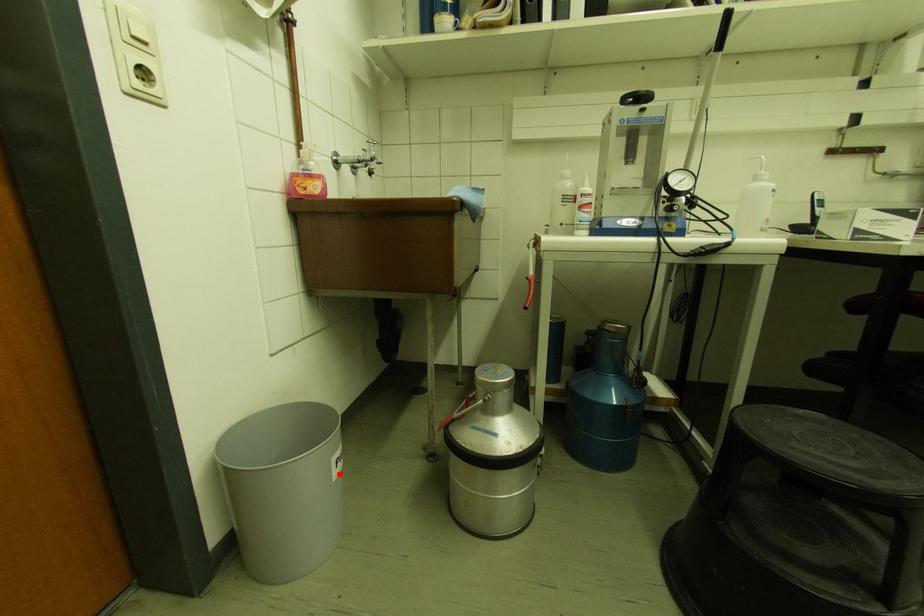
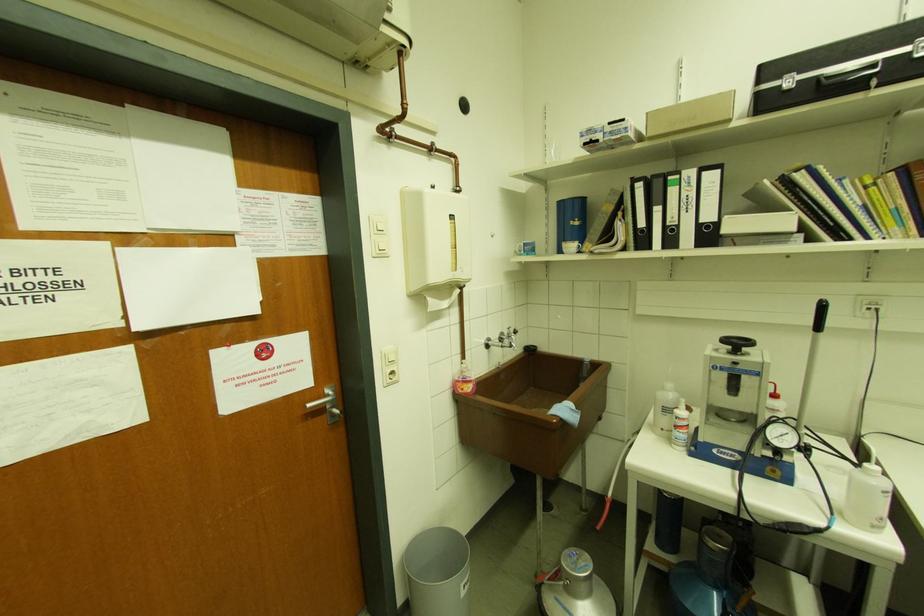
Find the pixel in the second image that matches the highlighted location in the first image.

(467, 594)